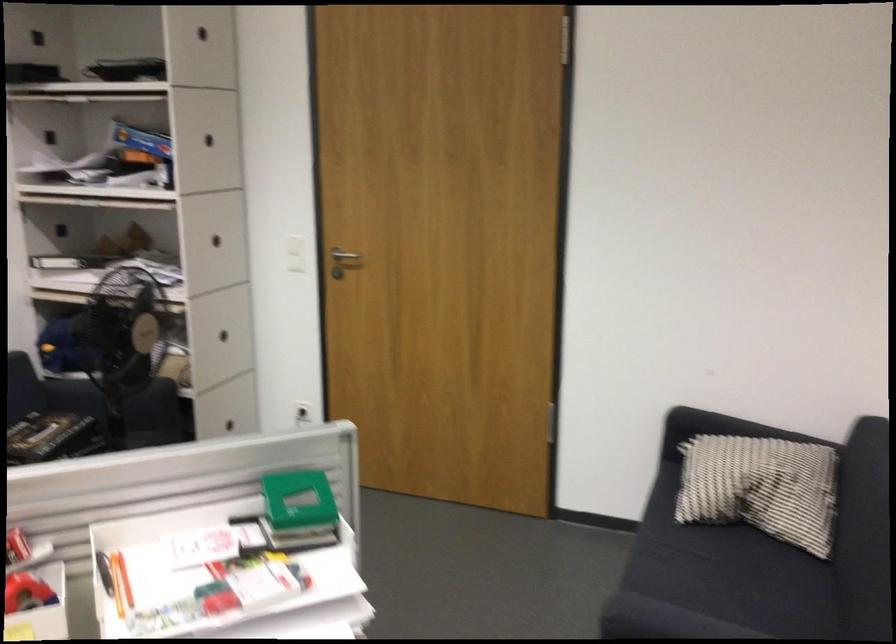
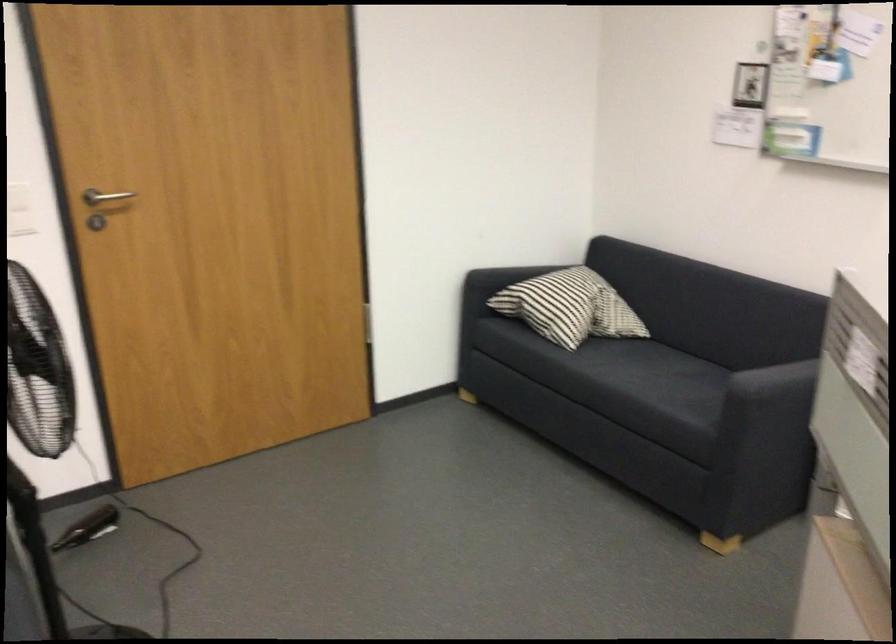
Where in the second image is the point corresponding to (354,249) from the first image?

(105, 196)